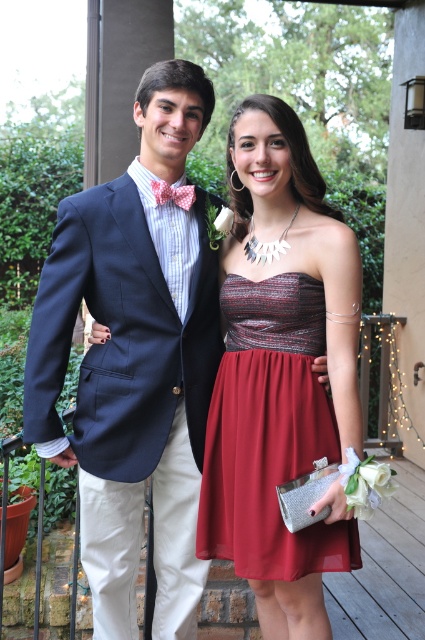
Question: Considering the relative positions of matte black blazer at upper left and shiny red chiffon dress at center in the image provided, where is matte black blazer at upper left located with respect to shiny red chiffon dress at center?

Choices:
 (A) right
 (B) left

Answer: (B)

Question: Which object is closer to the camera taking this photo?

Choices:
 (A) matte black blazer at upper left
 (B) pink dotted bow tie at upper center
 (C) shiny red chiffon dress at center

Answer: (C)

Question: Which point is farther from the camera taking this photo?

Choices:
 (A) (294, 456)
 (B) (87, 432)

Answer: (B)

Question: Which of the following is the closest to the observer?

Choices:
 (A) shiny red chiffon dress at center
 (B) pink dotted bow tie at upper center

Answer: (A)

Question: Does matte black blazer at upper left have a smaller size compared to pink dotted bow tie at upper center?

Choices:
 (A) yes
 (B) no

Answer: (B)

Question: Can you confirm if shiny red chiffon dress at center is positioned to the left of pink dotted bow tie at upper center?

Choices:
 (A) no
 (B) yes

Answer: (A)